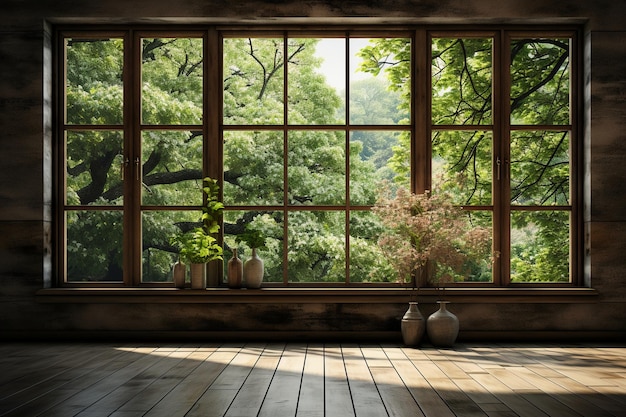
Identify the location of sections of windows on the top row. (101, 97), (175, 86), (250, 97), (310, 86), (376, 90), (463, 93), (526, 91).